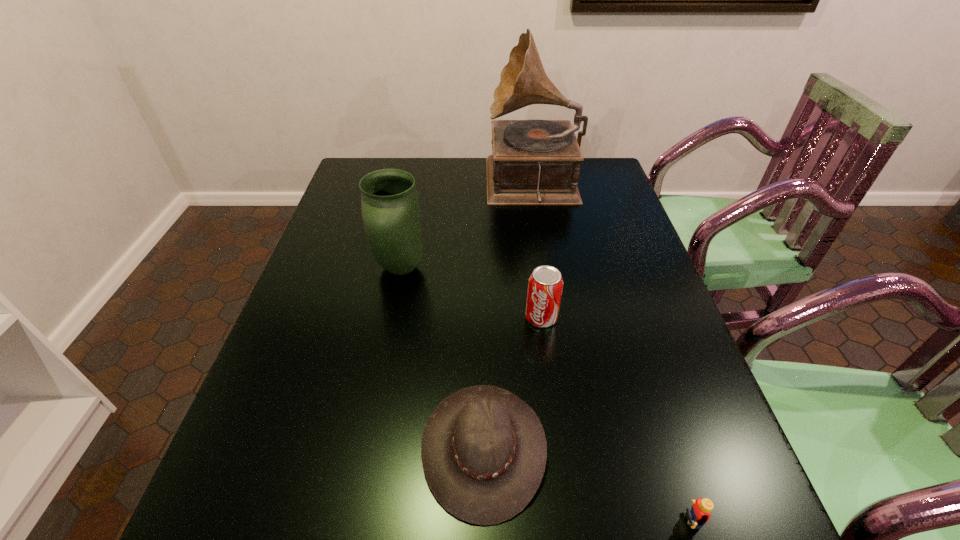
This screenshot has height=540, width=960. Find the location of `Lego located at the near edge`. Lego located at the near edge is located at coordinates (699, 514).

Where is `hat situated at the near edge`? The image size is (960, 540). hat situated at the near edge is located at coordinates (483, 450).

The width and height of the screenshot is (960, 540). Identify the location of record player positioned at the right edge. (534, 162).

Locate an element on the screen. The width and height of the screenshot is (960, 540). Lego that is at the right edge is located at coordinates (699, 514).

This screenshot has height=540, width=960. Identify the location of object positioned at the far right corner. (534, 162).

Where is `object located at the near right corner`? Image resolution: width=960 pixels, height=540 pixels. object located at the near right corner is located at coordinates (699, 514).

In the image, there is a desktop. In order to click on free space at the far edge in this screenshot , I will do `click(426, 186)`.

In the image, there is a desktop. Where is `vacant space at the left edge`? vacant space at the left edge is located at coordinates (332, 393).

Locate an element on the screen. The image size is (960, 540). free space at the right edge of the desktop is located at coordinates (624, 247).

You are a GUI agent. You are given a task and a screenshot of the screen. Output one action in this format:
    pyautogui.click(x=<x>, y=<y>)
    Task: Click on the vacant space at the far left corner of the desktop
    The image size is (960, 540).
    Given the screenshot: What is the action you would take?
    pyautogui.click(x=362, y=166)